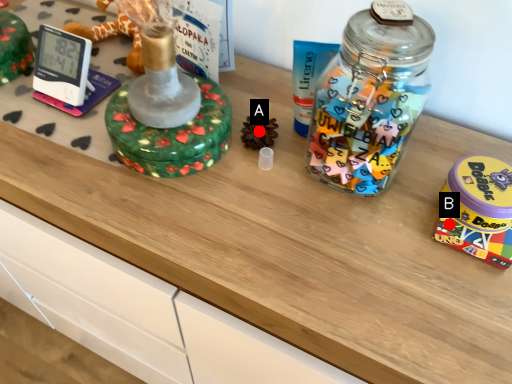
Question: Two points are circled on the image, labeled by A and B beside each circle. Which point appears closest to the camera in this image?

Choices:
 (A) A is closer
 (B) B is closer

Answer: (B)